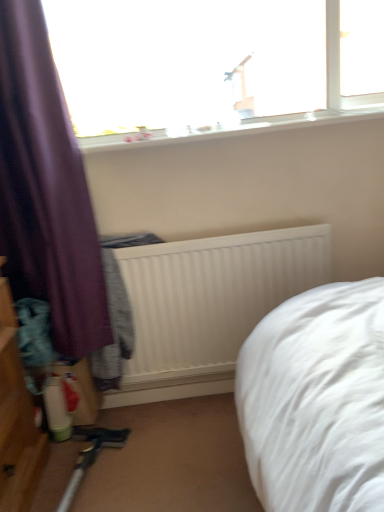
Question: Looking at the image, does white ribbed radiator at center seem bigger or smaller compared to white smooth window sill at upper center?

Choices:
 (A) big
 (B) small

Answer: (A)

Question: From a real-world perspective, is white ribbed radiator at center positioned above or below white smooth window sill at upper center?

Choices:
 (A) below
 (B) above

Answer: (A)

Question: Considering the real-world distances, which object is farthest from the white ribbed radiator at center?

Choices:
 (A) purple fabric curtain at left
 (B) white smooth window sill at upper center
 (C) transparent glass window at upper center

Answer: (C)

Question: Based on their relative distances, which object is farther from the transparent glass window at upper center?

Choices:
 (A) white smooth window sill at upper center
 (B) white ribbed radiator at center
 (C) purple fabric curtain at left

Answer: (B)